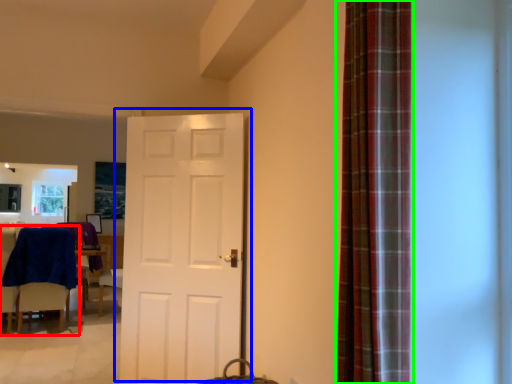
Question: Based on their relative distances, which object is nearer to chair (highlighted by a red box)? Choose from door (highlighted by a blue box) and curtain (highlighted by a green box).

Choices:
 (A) door
 (B) curtain

Answer: (A)